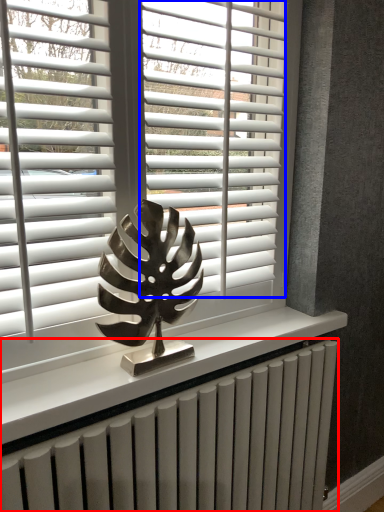
Question: Which point is further to the camera, radiator (highlighted by a red box) or blind (highlighted by a blue box)?

Choices:
 (A) radiator
 (B) blind

Answer: (B)